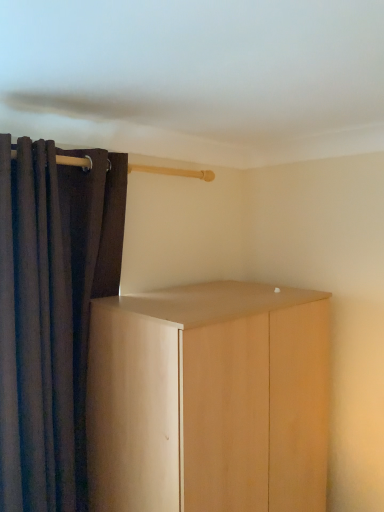
Question: Considering the relative positions of dark fabric curtain at left and light wood cupboard at center in the image provided, is dark fabric curtain at left to the left or to the right of light wood cupboard at center?

Choices:
 (A) left
 (B) right

Answer: (A)

Question: From a real-world perspective, is dark fabric curtain at left positioned above or below light wood cupboard at center?

Choices:
 (A) below
 (B) above

Answer: (B)

Question: Is dark fabric curtain at left situated inside light wood cupboard at center or outside?

Choices:
 (A) outside
 (B) inside

Answer: (A)

Question: Relative to dark fabric curtain at left, is light wood cupboard at center in front or behind?

Choices:
 (A) front
 (B) behind

Answer: (A)

Question: Considering the positions of point (306, 484) and point (44, 481), is point (306, 484) closer or farther from the camera than point (44, 481)?

Choices:
 (A) farther
 (B) closer

Answer: (A)

Question: From a real-world perspective, is light wood cupboard at center above or below dark fabric curtain at left?

Choices:
 (A) below
 (B) above

Answer: (A)

Question: Would you say light wood cupboard at center is to the left or to the right of dark fabric curtain at left in the picture?

Choices:
 (A) right
 (B) left

Answer: (A)